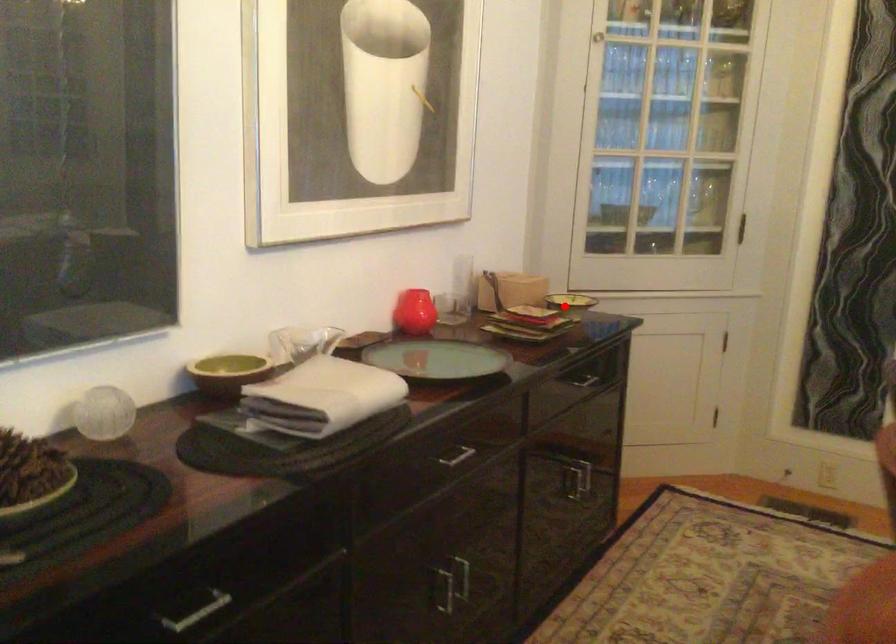
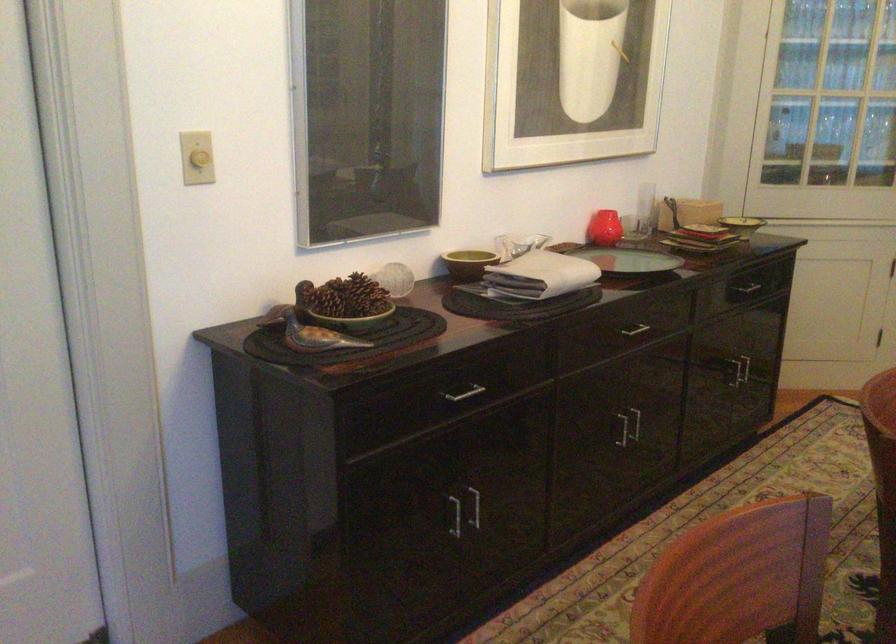
Question: I am providing you with two images of the same scene from different viewpoints. Given a red point in image1, look at the same physical point in image2. Is it:

Choices:
 (A) Closer to the viewpoint
 (B) Farther from the viewpoint

Answer: (B)